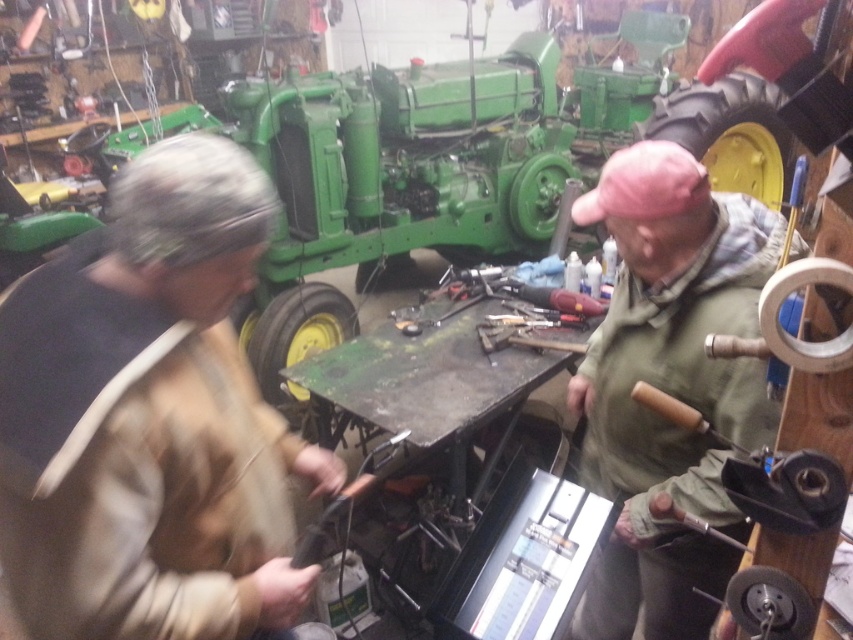
You are a safety inspector observing the workshop scene. You notice two workers wearing camouflage fabric jacket at left and green fabric jacket at upper right. Which worker is closer to you according to their positions?

A: The camouflage fabric jacket at left is in front of the green fabric jacket at upper right, so the worker in the camouflage fabric jacket at left is closer to you.

You are a drone operator trying to capture a closeup of two points in the workshop scene. The points are labeled as point (119,291) and point (625,435). Which point should you focus on first to get the closest possible shot without moving the drone?

Point (119,291) is closer to the camera than point (625,435), so focusing on point (119,291) first will allow you to capture a closer shot without moving the drone.

In the workshop scene, there are two people wearing different jackets. The camouflage fabric jacket at left and the green fabric jacket at upper right. Which jacket is shorter in height?

The camouflage fabric jacket at left is shorter in height compared to the green fabric jacket at upper right.